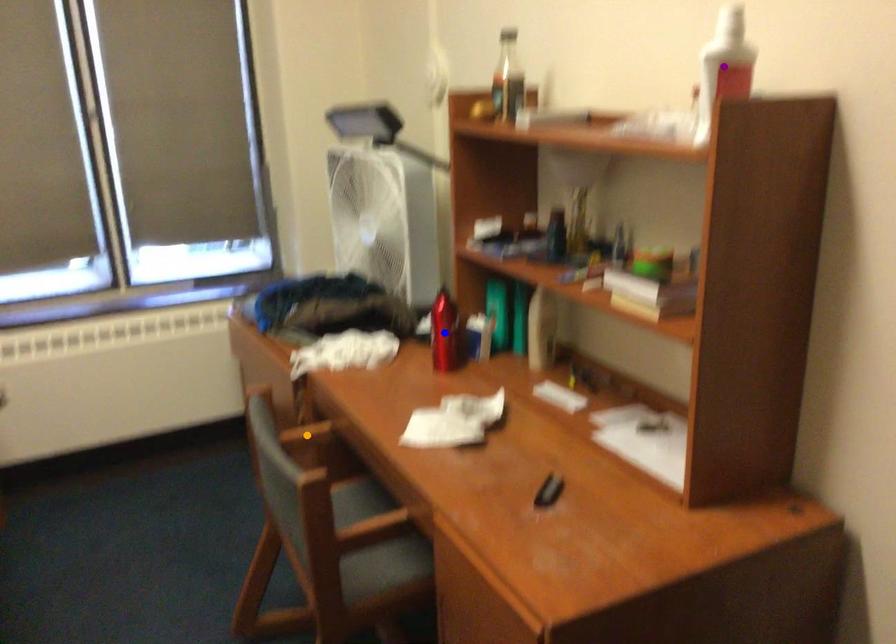
Order these from nearest to farthest:
- purple point
- blue point
- orange point

1. purple point
2. orange point
3. blue point